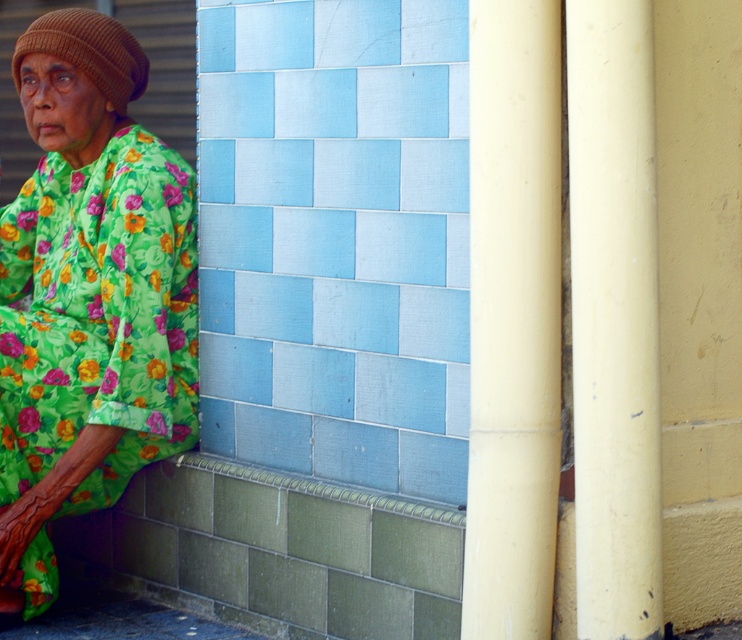
You are an interior designer evaluating the spatial arrangement of the room. The green floral dress at left and the green textured curb at lower left are both present. Which object occupies more space in the scene?

The green floral dress at left is larger in size than the green textured curb at lower left, so it occupies more space in the scene.

You are standing in front of the wall with the elderly woman. There are two points marked on the wall at coordinates point (22, 38) and point (459, 518). Which point is closer to you?

Point (22, 38) is further to the camera than point (459, 518), so the point closer to you is point (459, 518).